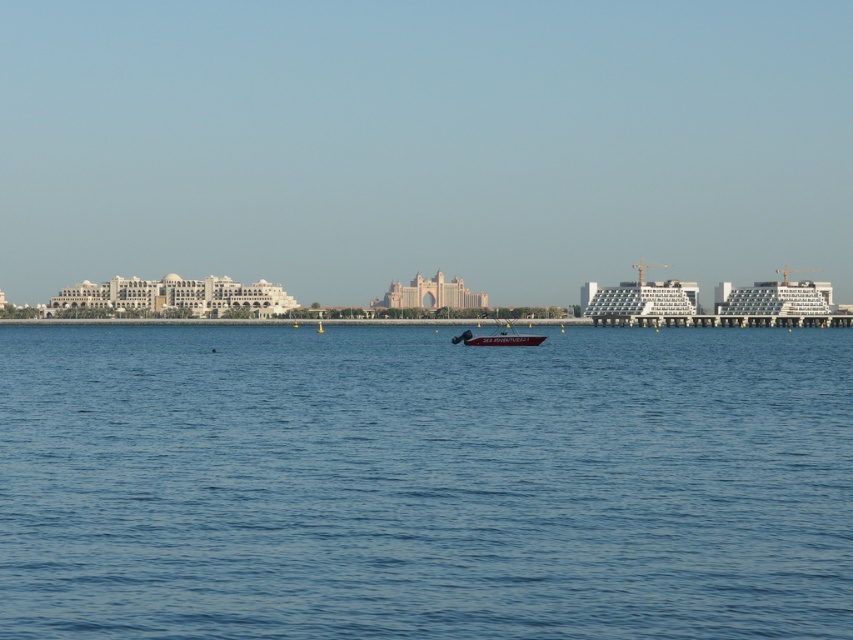
You are standing at the point marked as point (424, 483) in the coastal scene. What object is directly beneath your feet?

The blue water at center is located at point (424, 483), so the object directly beneath your feet is the blue water at center.

You are standing at the origin point of the image. Which direction should you move to reach the blue water at center?

You should move towards the coordinates point (x=424, y=483) to reach the blue water at center.